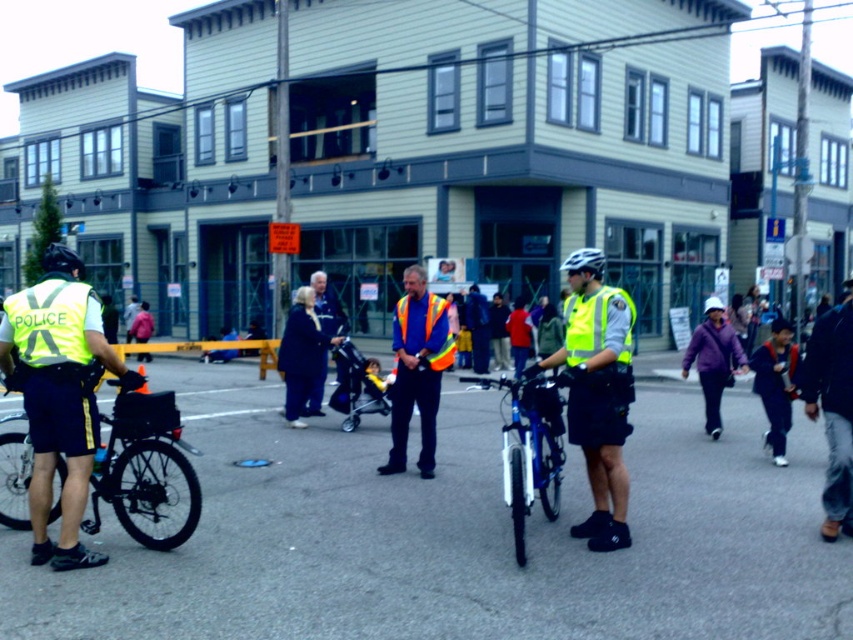
You are a pedestrian trying to cross the street in this scene. You see the reflective yellow vest at center and the black matte bicycle at left. Which object takes up more space in the image?

The black matte bicycle at left takes up more space than the reflective yellow vest at center because the reflective yellow vest at center occupies less space than black matte bicycle at left.